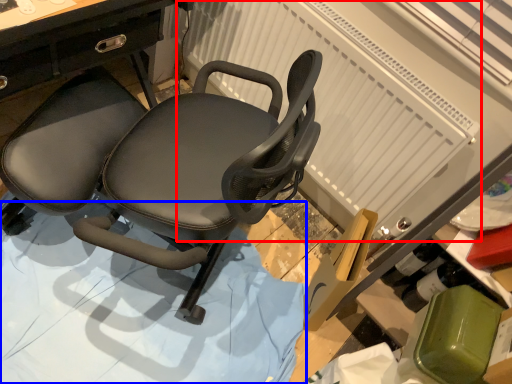
Question: Which point is closer to the camera, radiator (highlighted by a red box) or surface (highlighted by a blue box)?

Choices:
 (A) radiator
 (B) surface

Answer: (B)